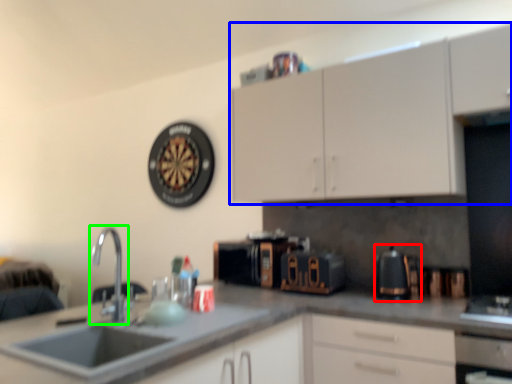
Question: Which is nearer to the coffeepot (highlighted by a red box)? cabinetry (highlighted by a blue box) or tap (highlighted by a green box).

Choices:
 (A) cabinetry
 (B) tap

Answer: (A)